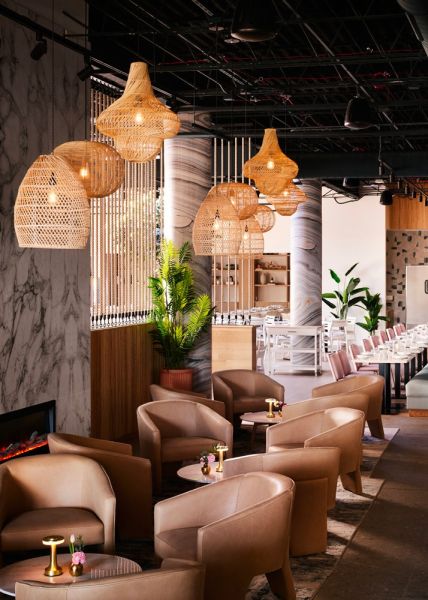
Image resolution: width=428 pixels, height=600 pixels. I want to click on rug, so click(x=348, y=572).